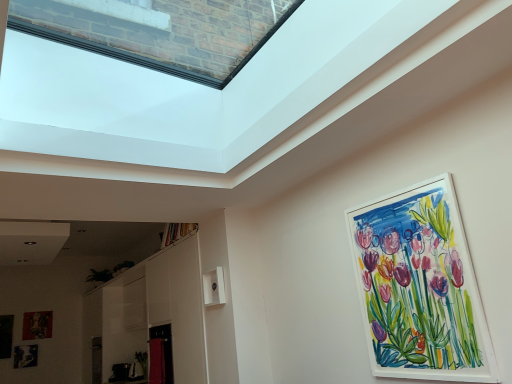
Question: Is metallic silver picture frame at lower left, which is the 2th picture frame in back-to-front order, thinner than matte black picture frame at lower left, which is counted as the 4th picture frame, starting from the front?

Choices:
 (A) no
 (B) yes

Answer: (B)

Question: Is metallic silver picture frame at lower left, arranged as the third picture frame when viewed from the right, shorter than matte black picture frame at lower left, which is counted as the 4th picture frame, starting from the front?

Choices:
 (A) no
 (B) yes

Answer: (B)

Question: From the image's perspective, does metallic silver picture frame at lower left, positioned as the 2th picture frame in left-to-right order, appear higher than matte black picture frame at lower left, which is counted as the 3th picture frame, starting from the bottom?

Choices:
 (A) no
 (B) yes

Answer: (A)

Question: Considering the relative sizes of metallic silver picture frame at lower left, which ranks as the 3th picture frame in front-to-back order, and matte black picture frame at lower left, which is the 2th picture frame from top to bottom, in the image provided, is metallic silver picture frame at lower left, which ranks as the 3th picture frame in front-to-back order, wider than matte black picture frame at lower left, which is the 2th picture frame from top to bottom,?

Choices:
 (A) no
 (B) yes

Answer: (A)

Question: Is metallic silver picture frame at lower left, which is the 1th picture frame from bottom to top, positioned beyond the bounds of matte black picture frame at lower left, marked as the third picture frame in a left-to-right arrangement?

Choices:
 (A) no
 (B) yes

Answer: (B)

Question: Considering the positions of metallic silver picture frame at lower left, positioned as the 2th picture frame in left-to-right order, and watercolor paper painting at upper right, placed as the 1th picture frame when sorted from front to back, in the image, is metallic silver picture frame at lower left, positioned as the 2th picture frame in left-to-right order, wider or thinner than watercolor paper painting at upper right, placed as the 1th picture frame when sorted from front to back,?

Choices:
 (A) wide
 (B) thin

Answer: (B)

Question: Relative to watercolor paper painting at upper right, placed as the 1th picture frame when sorted from front to back, is metallic silver picture frame at lower left, positioned as the 2th picture frame in left-to-right order, in front or behind?

Choices:
 (A) behind
 (B) front

Answer: (A)

Question: Based on their sizes in the image, would you say metallic silver picture frame at lower left, which is counted as the 4th picture frame, starting from the top, is bigger or smaller than watercolor paper painting at upper right, the 1th picture frame when ordered from right to left?

Choices:
 (A) big
 (B) small

Answer: (B)

Question: Is point (26, 349) closer or farther from the camera than point (379, 201)?

Choices:
 (A) farther
 (B) closer

Answer: (A)

Question: In terms of height, does matte black picture frame at lower left, marked as the third picture frame in a left-to-right arrangement, look taller or shorter compared to watercolor paper painting at upper right, which ranks as the fourth picture frame in bottom-to-top order?

Choices:
 (A) short
 (B) tall

Answer: (A)

Question: Is matte black picture frame at lower left, which is counted as the 4th picture frame, starting from the front, wider or thinner than watercolor paper painting at upper right, the 1th picture frame when ordered from right to left?

Choices:
 (A) wide
 (B) thin

Answer: (B)

Question: Is point (36, 329) positioned closer to the camera than point (373, 213)?

Choices:
 (A) closer
 (B) farther

Answer: (B)

Question: From the image's perspective, relative to watercolor paper painting at upper right, which ranks as the fourth picture frame in bottom-to-top order, is matte black picture frame at lower left, which ranks as the first picture frame in back-to-front order, above or below?

Choices:
 (A) below
 (B) above

Answer: (A)

Question: Relative to watercolor paper painting at upper right, which ranks as the fourth picture frame in bottom-to-top order, is matte black picture frame at lower left, which is counted as the 4th picture frame, starting from the right, in front or behind?

Choices:
 (A) front
 (B) behind

Answer: (B)

Question: Is matte black picture frame at lower left, the third picture frame from the top, inside or outside of watercolor paper painting at upper right, marked as the 1th picture frame in a top-to-bottom arrangement?

Choices:
 (A) outside
 (B) inside

Answer: (A)